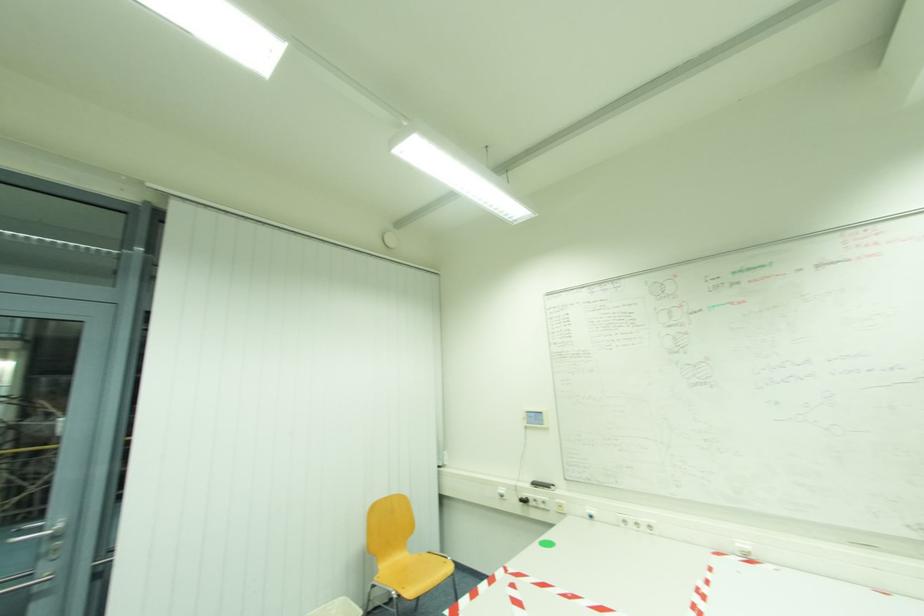
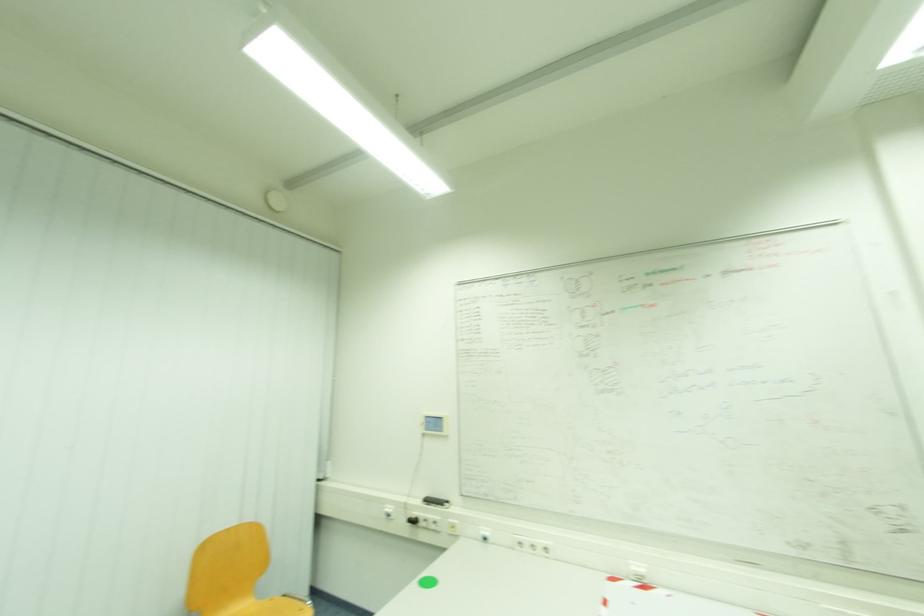
Question: The camera is either moving clockwise (left) or counter-clockwise (right) around the object. The first image is from the beginning of the video and the second image is from the end. Is the camera moving left or right when shooting the video?

Choices:
 (A) Left
 (B) Right

Answer: (A)